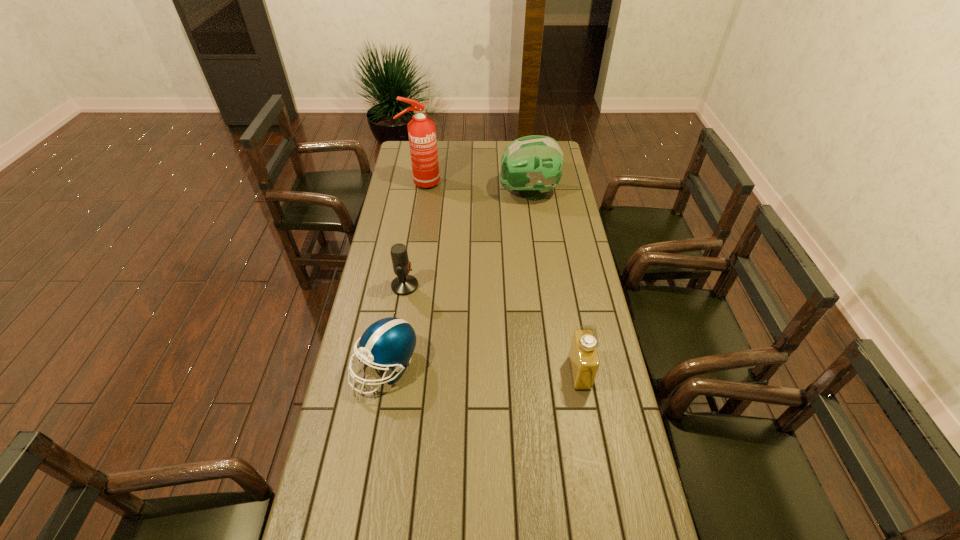
The height and width of the screenshot is (540, 960). In order to click on the tallest object in this screenshot , I will do `click(421, 130)`.

This screenshot has width=960, height=540. I want to click on the fourth shortest object, so pos(531,165).

This screenshot has width=960, height=540. Find the location of `the right football helmet`. the right football helmet is located at coordinates (531, 165).

Locate an element on the screen. The height and width of the screenshot is (540, 960). perfume is located at coordinates (583, 356).

At what (x,y) coordinates should I click in order to perform the action: click on the third nearest object. Please return your answer as a coordinate pair (x, y). The image size is (960, 540). Looking at the image, I should click on (404, 284).

Identify the location of the left football helmet. (389, 342).

Locate an element on the screen. the nearer football helmet is located at coordinates (389, 342).

Locate an element on the screen. vacant space located 0.310m at the nozzle of the tallest object is located at coordinates (504, 183).

Identify the location of vacant space situated on the visor of the right football helmet. This screenshot has width=960, height=540. (477, 193).

The width and height of the screenshot is (960, 540). In order to click on free space located 0.260m on the visor of the right football helmet in this screenshot , I will do `click(444, 193)`.